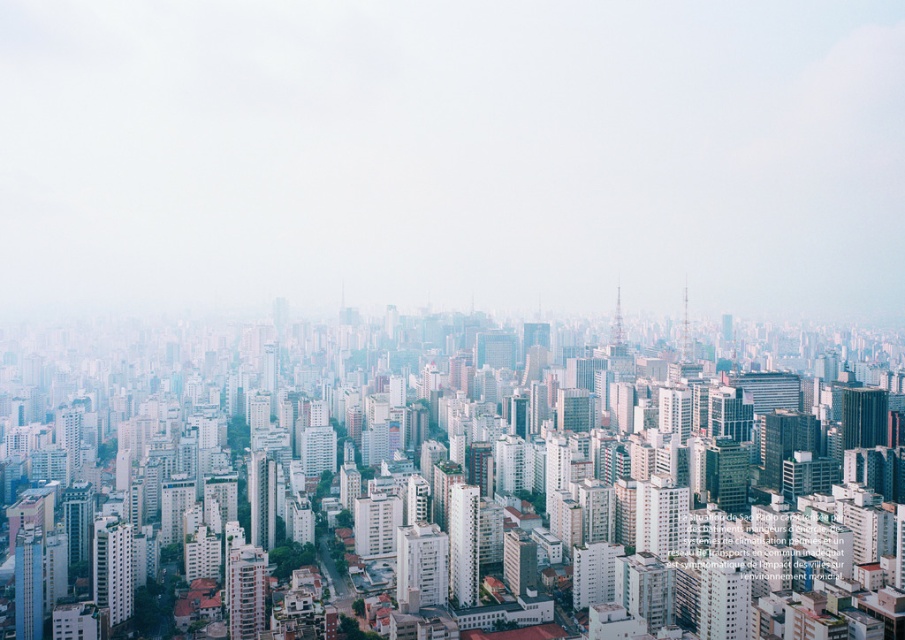
You are standing in the middle of the city and looking at two points in the urban skyline. The first point is at coordinate point (556, 253) and the second is at point (413, 536). Which point is closer to your eyes?

Point (556, 253) is further to the camera than point (413, 536), so the point closer to your eyes is point (413, 536).

You are an urban planner analyzing the city layout. You notice the white foggy sky at upper center. Based on its position, can you determine if it is closer to the top or bottom of the image?

The white foggy sky at upper center is located at point coordinates where the y value is 0.499, which is nearly halfway between the bottom and top of the image. Since the coordinate system typically places the origin at the bottom left, a y value of approximately 0.5 would mean it is at the vertical midpoint. However, since the question asks whether it is closer to the top or bottom, the midpoint would technically be equidistant. But given the description mentions it is at upper center, the coordinates may

You are a drone operator trying to capture a clear aerial shot of the matte glass skyscraper at lower left. However, the white foggy sky at upper center is obstructing your view. Can you adjust your camera angle to see the entire skyscraper without the sky blocking it?

The matte glass skyscraper at lower left is behind the white foggy sky at upper center, so adjusting the camera angle downward might allow you to see the entire skyscraper without the sky obstructing it.